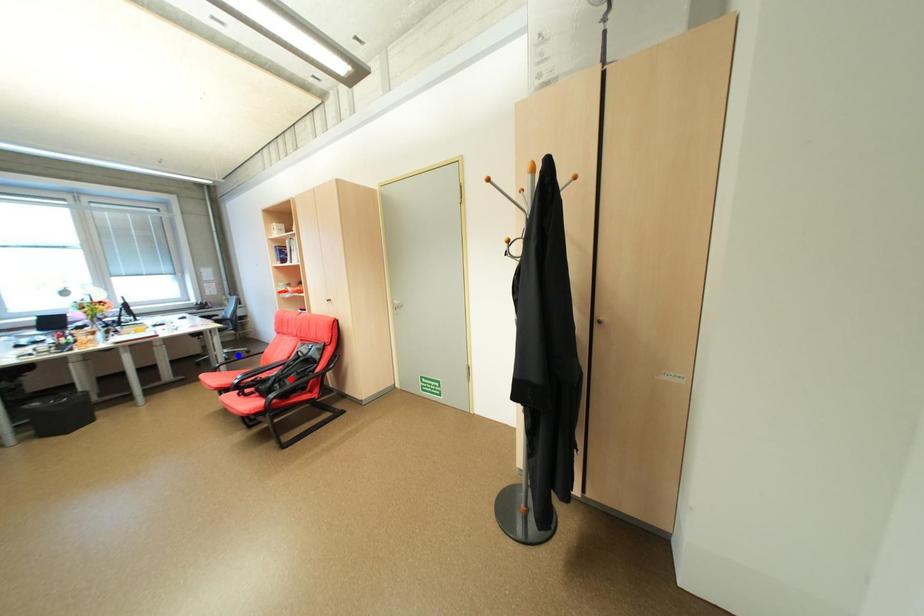
Question: Which of the two points in the image is closer to the camera?

Choices:
 (A) Blue point is closer.
 (B) Red point is closer.

Answer: (B)